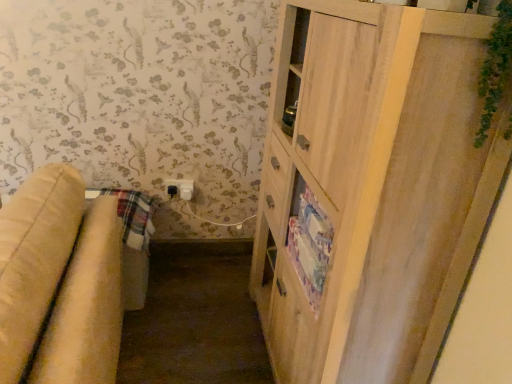
Question: In which direction should I rotate to look at white plastic electric outlet at lower center?

Choices:
 (A) left
 (B) right

Answer: (A)

Question: From a real-world perspective, is beige fabric studio couch at left under light wood cabinet at right?

Choices:
 (A) yes
 (B) no

Answer: (A)

Question: Can you confirm if beige fabric studio couch at left is positioned to the right of light wood cabinet at right?

Choices:
 (A) no
 (B) yes

Answer: (A)

Question: Considering the relative positions of beige fabric studio couch at left and light wood cabinet at right in the image provided, is beige fabric studio couch at left to the left of light wood cabinet at right from the viewer's perspective?

Choices:
 (A) yes
 (B) no

Answer: (A)

Question: Considering the relative sizes of beige fabric studio couch at left and light wood cabinet at right in the image provided, is beige fabric studio couch at left wider than light wood cabinet at right?

Choices:
 (A) yes
 (B) no

Answer: (A)

Question: Considering the relative sizes of beige fabric studio couch at left and light wood cabinet at right in the image provided, is beige fabric studio couch at left bigger than light wood cabinet at right?

Choices:
 (A) yes
 (B) no

Answer: (A)

Question: Is beige fabric studio couch at left positioned far away from light wood cabinet at right?

Choices:
 (A) no
 (B) yes

Answer: (A)

Question: Would you consider beige fabric studio couch at left to be distant from white plastic electric outlet at lower center?

Choices:
 (A) yes
 (B) no

Answer: (A)

Question: From a real-world perspective, is beige fabric studio couch at left over white plastic electric outlet at lower center?

Choices:
 (A) no
 (B) yes

Answer: (A)

Question: Does beige fabric studio couch at left have a lesser width compared to white plastic electric outlet at lower center?

Choices:
 (A) yes
 (B) no

Answer: (B)

Question: From a real-world perspective, is beige fabric studio couch at left positioned under white plastic electric outlet at lower center based on gravity?

Choices:
 (A) yes
 (B) no

Answer: (A)

Question: Does beige fabric studio couch at left have a greater width compared to white plastic electric outlet at lower center?

Choices:
 (A) no
 (B) yes

Answer: (B)

Question: Does beige fabric studio couch at left have a smaller size compared to white plastic electric outlet at lower center?

Choices:
 (A) yes
 (B) no

Answer: (B)

Question: Is white plastic electric outlet at lower center completely or partially inside light wood cabinet at right?

Choices:
 (A) yes
 (B) no

Answer: (B)